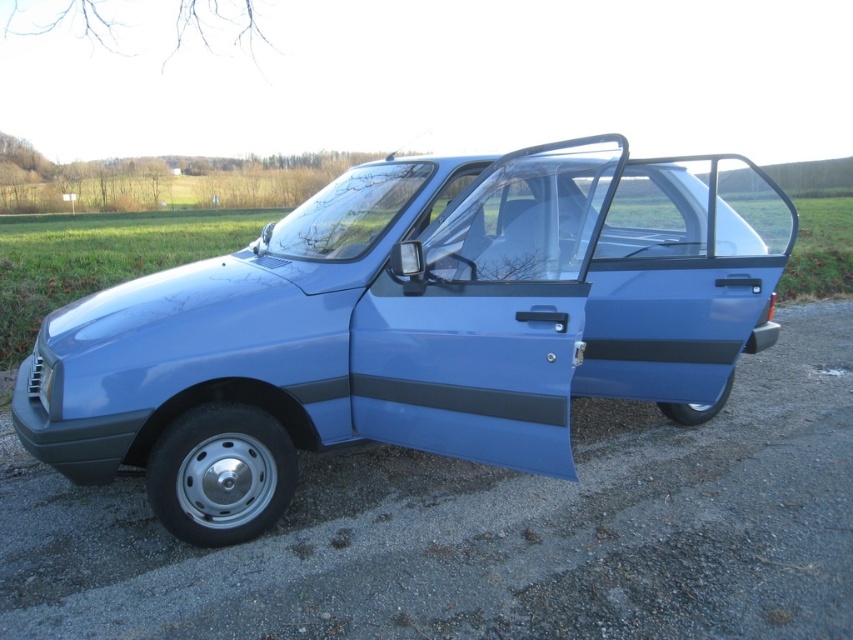
You are a delivery person trying to load a package into the matte blue car at center. The black matte stripe at door right is blocking the access to the trunk. Can you move the stripe to the side?

The matte blue car at center is in front of the black matte stripe at door right, meaning the stripe is part of the car and cannot be moved. You will need to find another way to access the trunk without moving the stripe.

Consider the image. You are a painter standing on the ground next to the matte blue car at center. You want to paint the black matte stripe at door right without moving the car. Can you reach the stripe from your current position?

The matte blue car at center is located above the black matte stripe at door right, so the stripe is positioned lower on the car. Since you are standing on the ground, you can easily reach the black matte stripe at door right without needing to move the car.

You are standing in front of the small blue car with the open driver side door. You notice two points marked on the car. One is at coordinate point (68,353) and the other is at point (639,353). Which point is closer to you?

The point at (68,353) is closer to you than the point at (639,353).